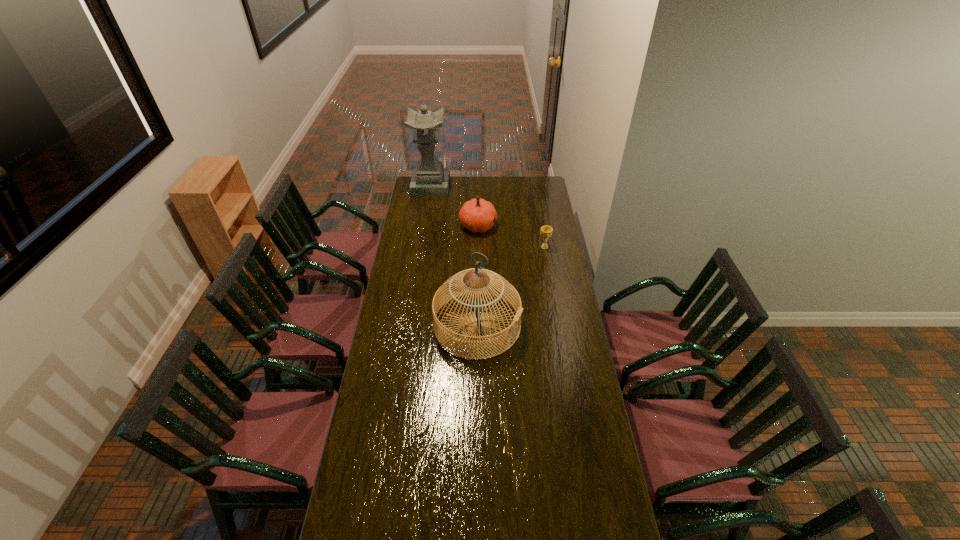
The height and width of the screenshot is (540, 960). What are the coordinates of `the tallest object` in the screenshot? It's located at (429, 179).

This screenshot has width=960, height=540. Identify the location of the farthest object. (429, 179).

Locate an element on the screen. the third shortest object is located at coordinates (457, 284).

Identify the location of birdcage. This screenshot has height=540, width=960. (457, 284).

Where is `the second farthest object`? the second farthest object is located at coordinates (477, 215).

What are the coordinates of `the third tallest object` in the screenshot? It's located at (477, 215).

Identify the location of the third farthest object. (546, 231).

Locate an element on the screen. the shortest object is located at coordinates (546, 231).

The width and height of the screenshot is (960, 540). Find the location of `free space located at the front opening of the farthest object`. free space located at the front opening of the farthest object is located at coordinates (461, 187).

At what (x,y) coordinates should I click in order to perform the action: click on vacant space situated 0.110m on the left of the nearest object. Please return your answer as a coordinate pair (x, y). The width and height of the screenshot is (960, 540). Looking at the image, I should click on (410, 325).